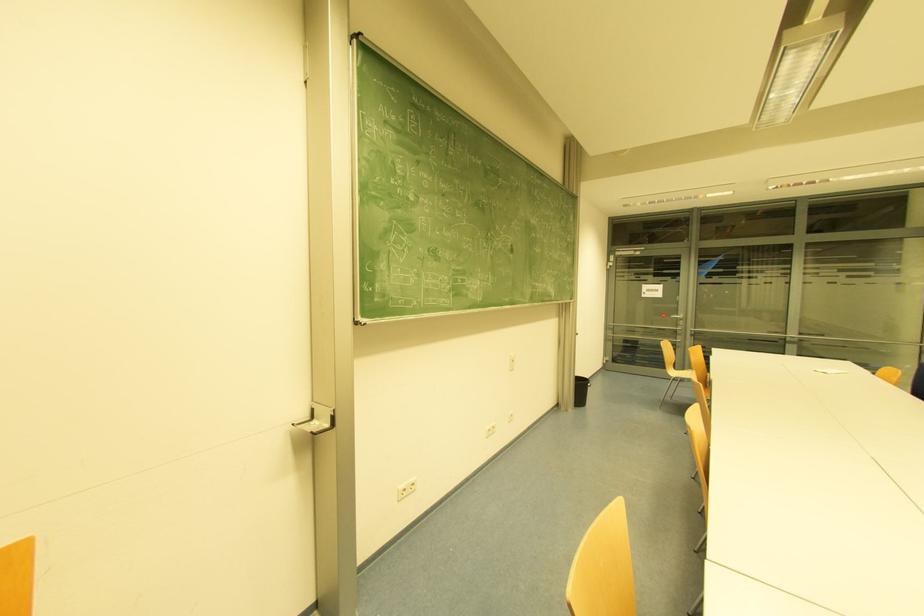
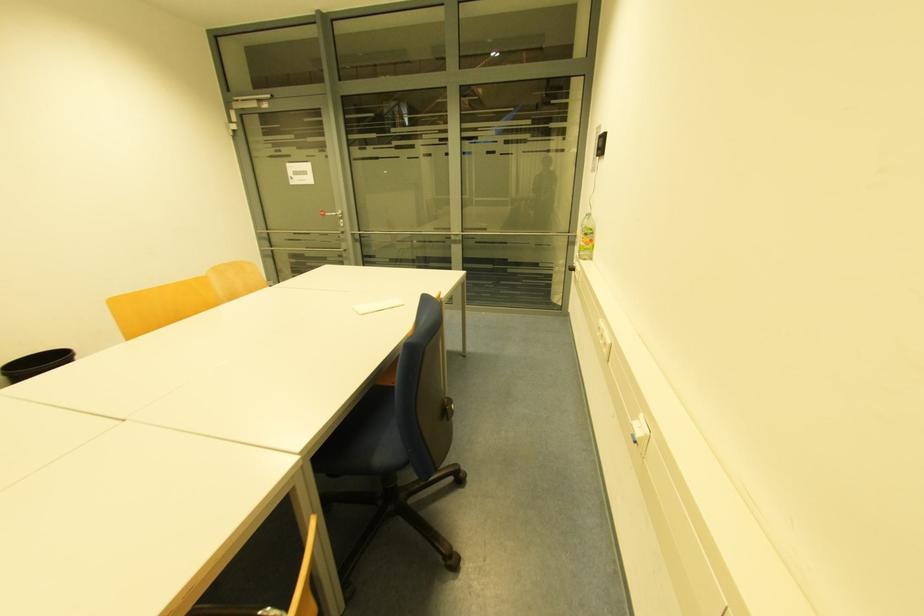
In a continuous first-person perspective shot, in which direction is the camera moving?

The movement direction of the cameraman is right, forward.